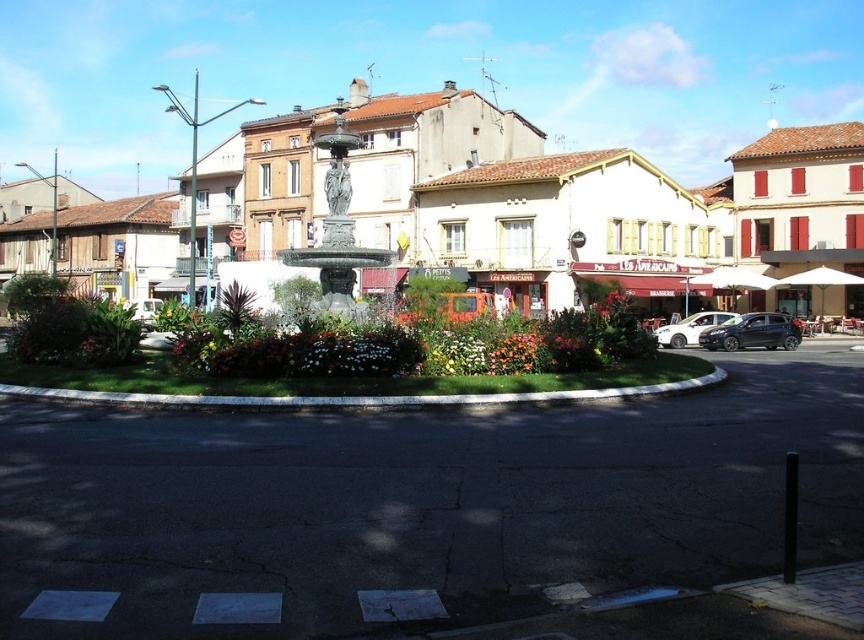
You are an event planner setting up a flower arrangement for a city festival. You have the green marble fountain at center and the floral bouquet at center in the plaza. Which object is taller and should be considered for visibility when placing decorations?

The green marble fountain at center is taller than the floral bouquet at center, so it should be the primary consideration for visibility when placing decorations.

You are a pedestrian standing in the plaza and want to cross the street to reach the fountain. There are two cars parked on the right side of the street. Which car is closer to the curb? The black matte hatchback at right or the satin silver sedan at right?

The black matte hatchback at right is positioned under the satin silver sedan at right, meaning the black matte hatchback at right is closer to the curb than the satin silver sedan at right.